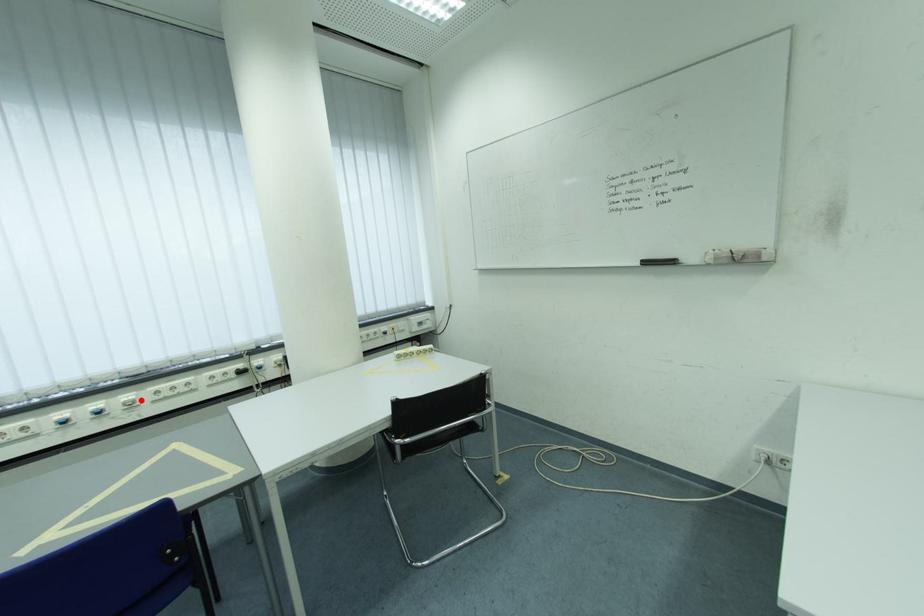
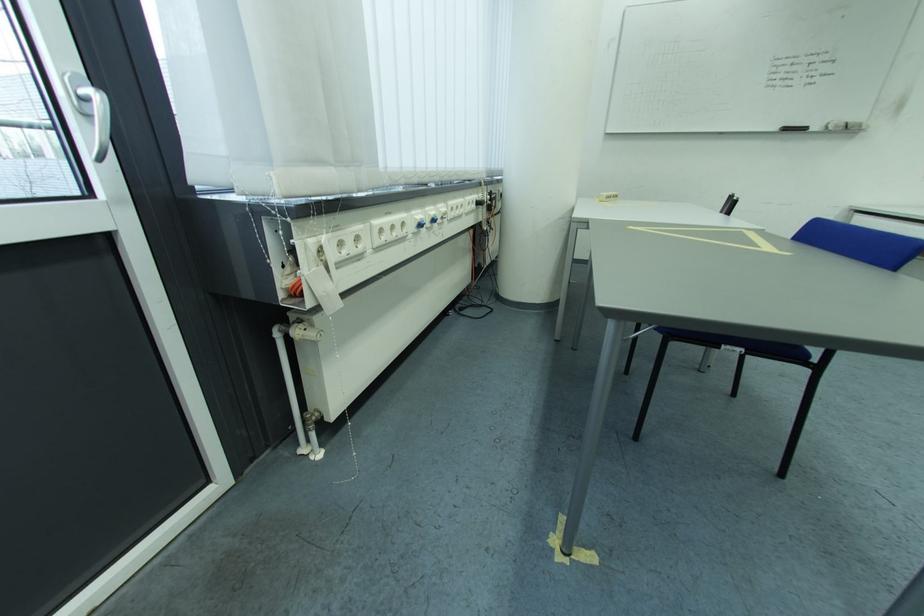
The point at the highlighted location is marked in the first image. Where is the corresponding point in the second image?

(454, 212)